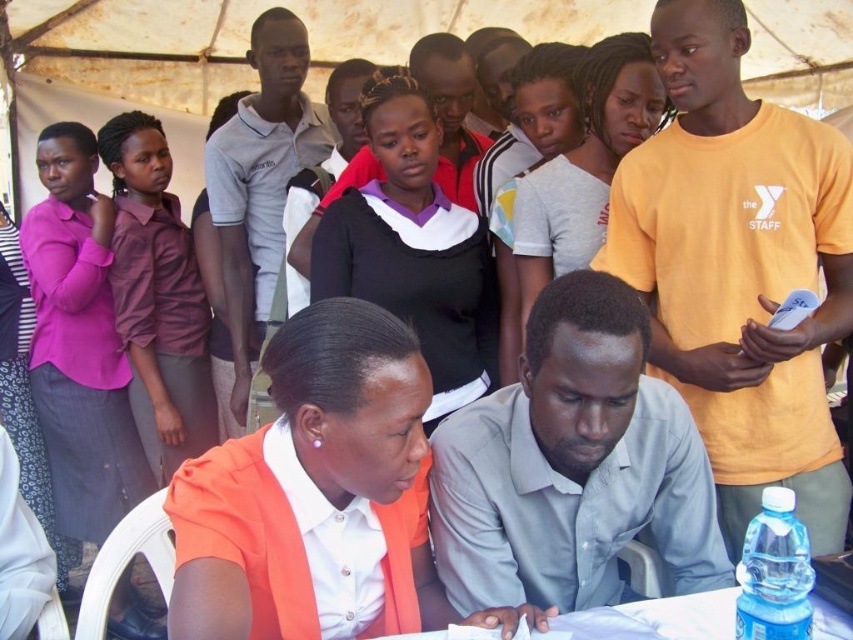
Question: Which of the following is the farthest from the observer?

Choices:
 (A) (126, 417)
 (B) (140, 310)
 (C) (550, 580)
 (D) (253, 157)

Answer: (A)

Question: Which point is farther from the camera taking this photo?

Choices:
 (A) (608, 152)
 (B) (350, 406)
 (C) (59, 125)

Answer: (C)

Question: Considering the relative positions of black matte shirt at center and matte black shirt at upper center in the image provided, where is black matte shirt at center located with respect to matte black shirt at upper center?

Choices:
 (A) right
 (B) left

Answer: (B)

Question: Which object appears farthest from the camera in this image?

Choices:
 (A) matte pink blouse at left
 (B) black matte shirt at center

Answer: (A)

Question: Can you confirm if gray cotton shirt at center is smaller than black matte shirt at center?

Choices:
 (A) yes
 (B) no

Answer: (B)

Question: Is orange fabric shirt at lower center wider than light gray cotton shirt at upper center?

Choices:
 (A) no
 (B) yes

Answer: (B)